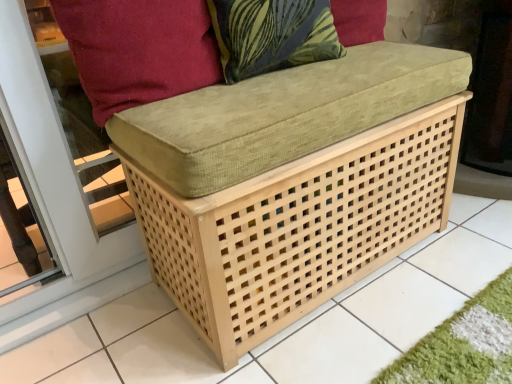
Question: Is velvety green pillow at upper center surrounded by suede-like red cushion at upper left?

Choices:
 (A) yes
 (B) no

Answer: (B)

Question: Is suede-like red cushion at upper left to the left of velvety green pillow at upper center from the viewer's perspective?

Choices:
 (A) no
 (B) yes

Answer: (B)

Question: Is suede-like red cushion at upper left turned away from velvety green pillow at upper center?

Choices:
 (A) no
 (B) yes

Answer: (A)

Question: Considering the relative sizes of suede-like red cushion at upper left and velvety green pillow at upper center in the image provided, is suede-like red cushion at upper left smaller than velvety green pillow at upper center?

Choices:
 (A) no
 (B) yes

Answer: (A)

Question: Does suede-like red cushion at upper left appear on the right side of velvety green pillow at upper center?

Choices:
 (A) yes
 (B) no

Answer: (B)

Question: Does suede-like red cushion at upper left come in front of velvety green pillow at upper center?

Choices:
 (A) yes
 (B) no

Answer: (A)

Question: From a real-world perspective, is velvety green pillow at upper center positioned under suede-like red cushion at upper left based on gravity?

Choices:
 (A) yes
 (B) no

Answer: (B)

Question: Can you confirm if velvety green pillow at upper center is bigger than suede-like red cushion at upper left?

Choices:
 (A) no
 (B) yes

Answer: (A)

Question: Can you confirm if velvety green pillow at upper center is wider than suede-like red cushion at upper left?

Choices:
 (A) yes
 (B) no

Answer: (A)

Question: Is velvety green pillow at upper center to the right of suede-like red cushion at upper left from the viewer's perspective?

Choices:
 (A) no
 (B) yes

Answer: (B)

Question: Can you confirm if velvety green pillow at upper center is positioned to the left of suede-like red cushion at upper left?

Choices:
 (A) no
 (B) yes

Answer: (A)

Question: Is suede-like red cushion at upper left a part of velvety green pillow at upper center?

Choices:
 (A) no
 (B) yes

Answer: (A)

Question: From the image's perspective, is velvety green pillow at upper center located above or below suede-like red cushion at upper left?

Choices:
 (A) below
 (B) above

Answer: (B)